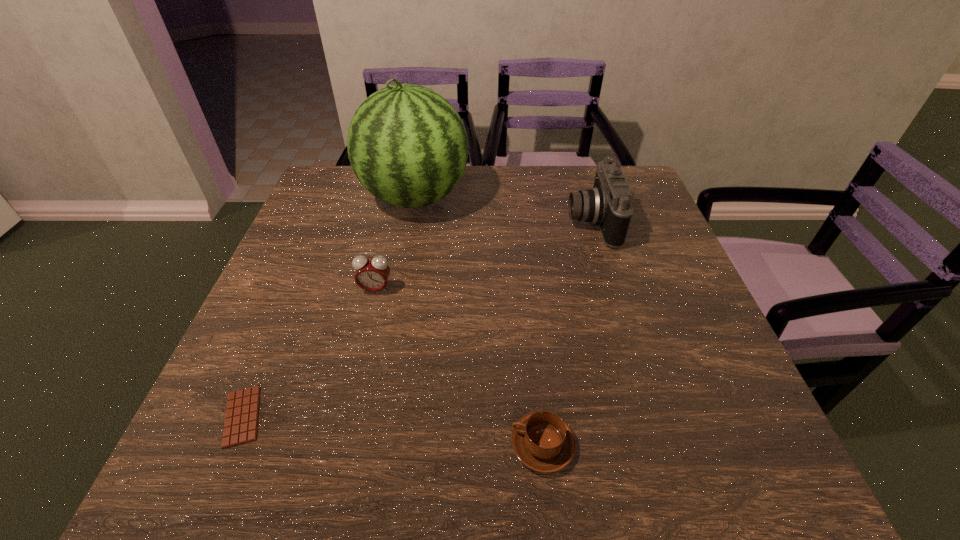
At what (x,y) coordinates should I click in order to perform the action: click on cappuccino located in the near edge section of the desktop. Please return your answer as a coordinate pair (x, y). The width and height of the screenshot is (960, 540). Looking at the image, I should click on (544, 442).

Find the location of `candy bar located in the near edge section of the desktop`. candy bar located in the near edge section of the desktop is located at coordinates (241, 419).

I want to click on watermelon that is at the left edge, so click(x=407, y=145).

Locate an element on the screen. The width and height of the screenshot is (960, 540). candy bar present at the left edge is located at coordinates (241, 419).

Image resolution: width=960 pixels, height=540 pixels. In order to click on object at the right edge in this screenshot , I will do `click(608, 205)`.

Where is `object located in the far left corner section of the desktop`? object located in the far left corner section of the desktop is located at coordinates (407, 145).

Locate an element on the screen. object located in the near left corner section of the desktop is located at coordinates (241, 419).

Find the location of a particular element. This screenshot has height=540, width=960. object at the far right corner is located at coordinates (608, 205).

The height and width of the screenshot is (540, 960). I want to click on vacant space at the far edge of the desktop, so click(x=571, y=181).

Image resolution: width=960 pixels, height=540 pixels. What are the coordinates of `vacant space at the near edge of the desktop` in the screenshot? It's located at coord(331,443).